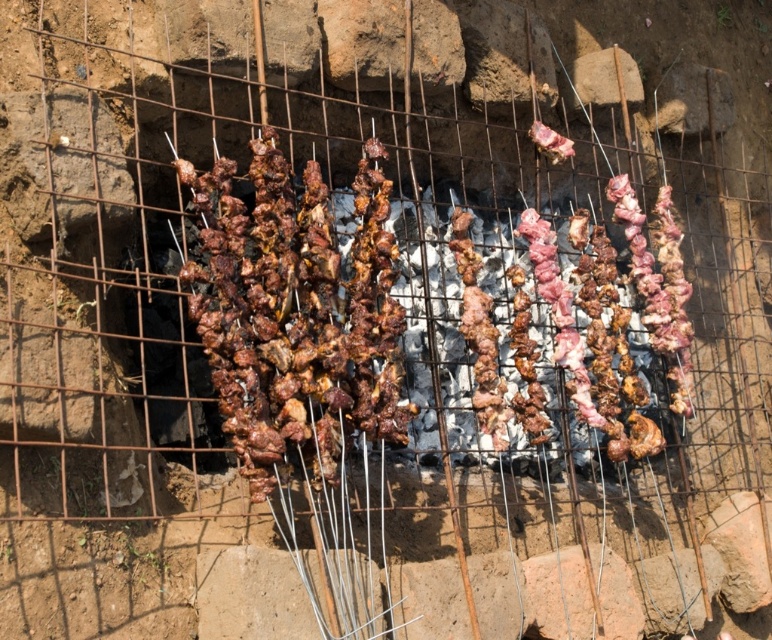
You are a chef preparing skewers for a dinner party. You need to retrieve the brown charred skewers at center from the grill. Where exactly should you look on the grill to find them?

The brown charred skewers at center are located at point coordinates of (300, 308) on the grill.

You are a chef preparing skewers for a barbecue. You have two types of skewers in the center of your grill setup. The brown charred skewers at center and the pink raw meat at center. Which one is bigger in size?

The brown charred skewers at center has a larger size compared to the pink raw meat at center, so the brown charred skewers at center is bigger.

You are a chef preparing skewers for a dinner party. You notice two items labeled as brown charred skewers at center and brown charred meat at center. Which one is positioned higher in the image?

The brown charred skewers at center are positioned higher than the brown charred meat at center because they are located above it.